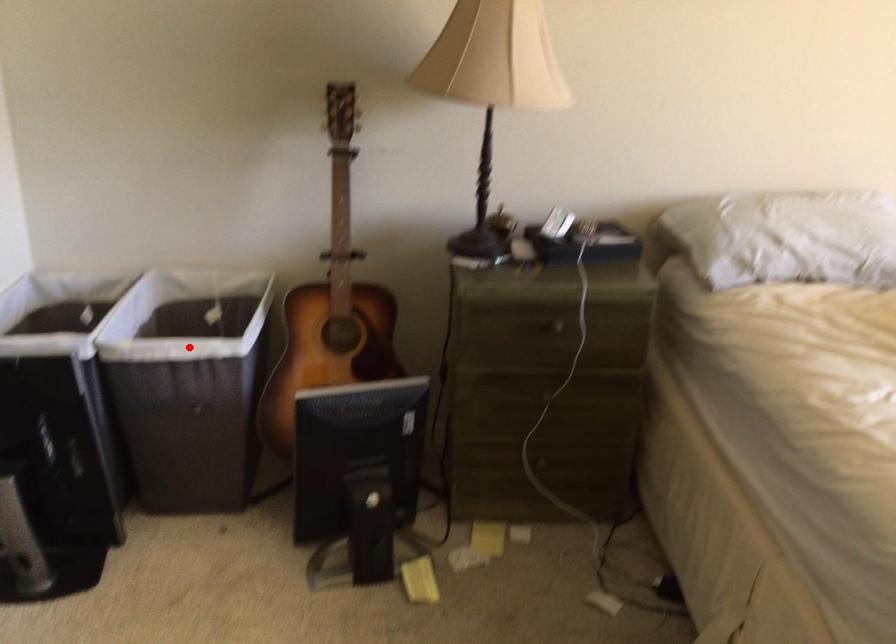
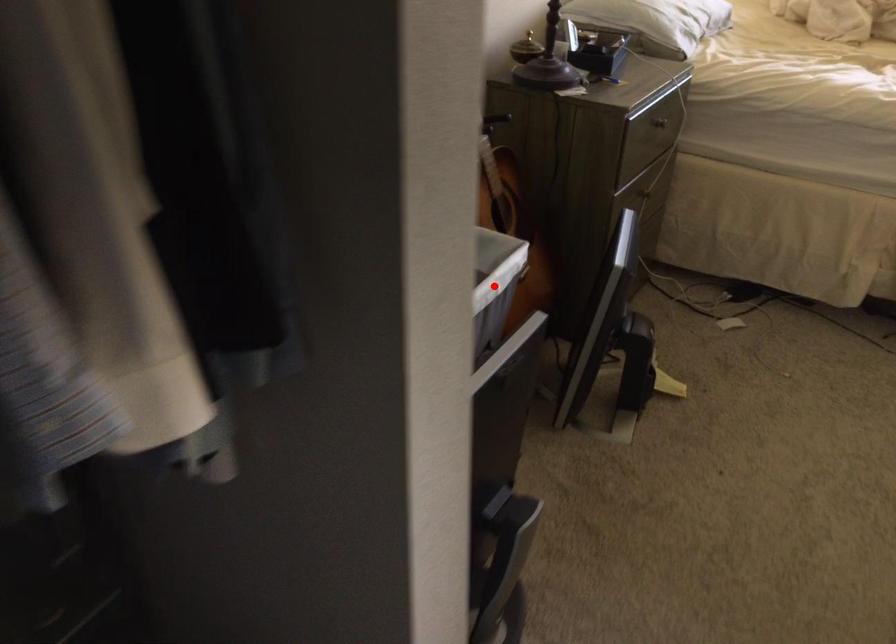
I am providing you with two images of the same scene from different viewpoints. A red point is marked on the first image and another point is marked on the second image. Is the marked point in image1 the same physical position as the marked point in image2?

Yes